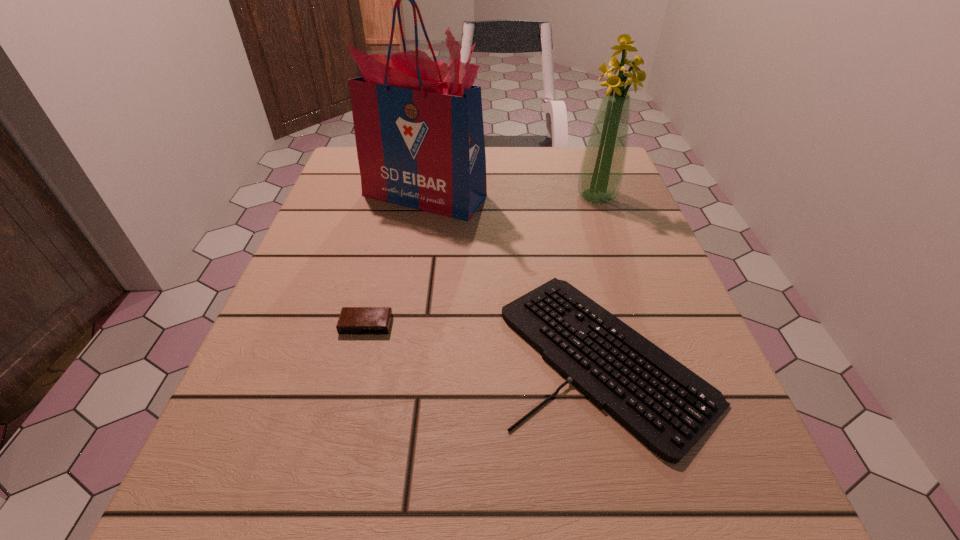
Locate an element on the screen. The height and width of the screenshot is (540, 960). vacant space at the far left corner of the desktop is located at coordinates (337, 183).

The image size is (960, 540). Find the location of `vacant point located between the alarm clock and the computer keyboard`. vacant point located between the alarm clock and the computer keyboard is located at coordinates [x=486, y=340].

In order to click on vacant space in between the grocery bag and the second tallest object in this screenshot , I will do `click(511, 196)`.

Identify the location of vacant area between the alarm clock and the computer keyboard. (486, 340).

Where is `vacant region between the second tallest object and the grocery bag`? The width and height of the screenshot is (960, 540). vacant region between the second tallest object and the grocery bag is located at coordinates (511, 196).

The image size is (960, 540). Identify the location of free space between the alarm clock and the tallest object. (396, 260).

The width and height of the screenshot is (960, 540). Identify the location of empty location between the computer keyboard and the alarm clock. (486, 340).

The width and height of the screenshot is (960, 540). Find the location of `vacant area between the bouquet and the computer keyboard`. vacant area between the bouquet and the computer keyboard is located at coordinates (601, 275).

You are a GUI agent. You are given a task and a screenshot of the screen. Output one action in this format:
    pyautogui.click(x=<x>, y=<y>)
    Task: Click on the free space between the bouquet and the computer keyboard
    This screenshot has height=540, width=960.
    Given the screenshot: What is the action you would take?
    pyautogui.click(x=601, y=275)

You are a GUI agent. You are given a task and a screenshot of the screen. Output one action in this format:
    pyautogui.click(x=<x>, y=<y>)
    Task: Click on the vacant area between the bouquet and the computer keyboard
    This screenshot has height=540, width=960.
    Given the screenshot: What is the action you would take?
    pyautogui.click(x=601, y=275)